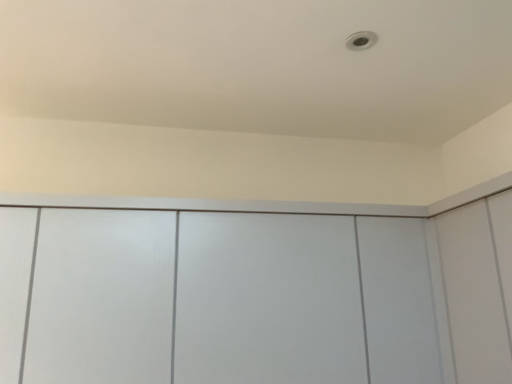
Question: Should I look upward or downward to see white matte cabinet at center?

Choices:
 (A) down
 (B) up

Answer: (A)